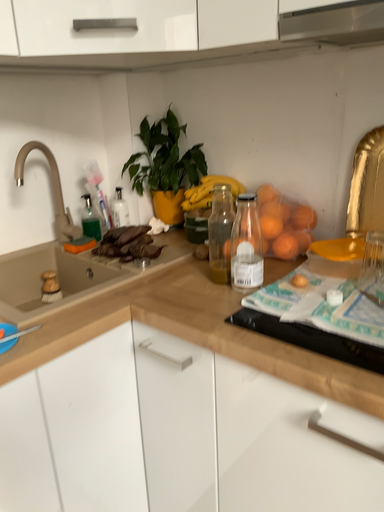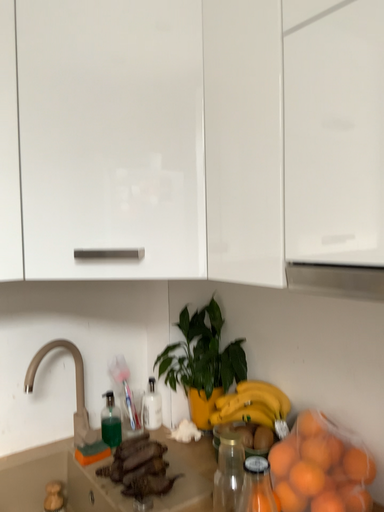
Question: How did the camera likely rotate when shooting the video?

Choices:
 (A) rotated upward
 (B) rotated downward

Answer: (A)